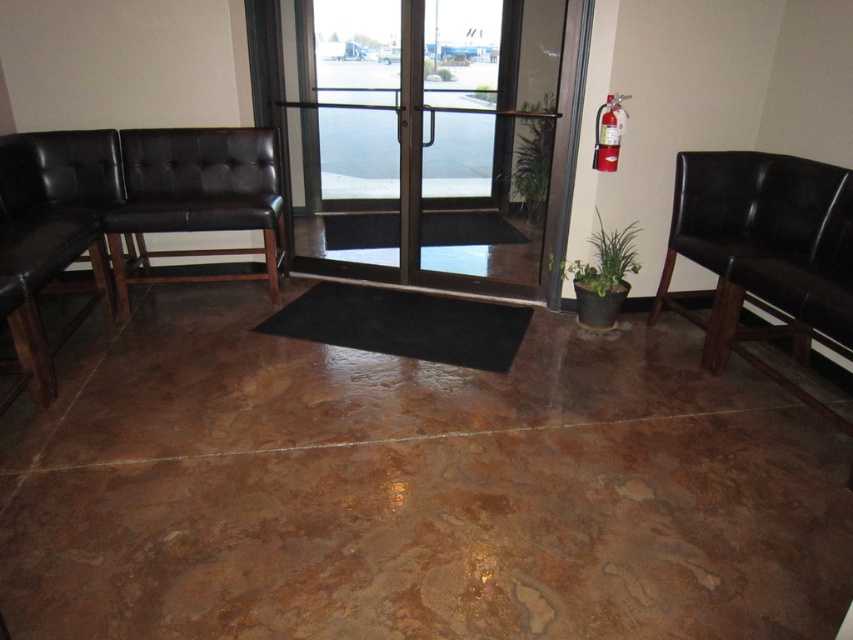
Looking at this image, between black leather chair at right and matte black bench at left, which one appears on the right side from the viewer's perspective?

Positioned to the right is black leather chair at right.

This screenshot has width=853, height=640. Describe the element at coordinates (764, 236) in the screenshot. I see `black leather chair at right` at that location.

Is point (660, 282) less distant than point (228, 193)?

Yes.

Identify the location of black leather chair at right. (764, 236).

This screenshot has height=640, width=853. What do you see at coordinates (764, 236) in the screenshot?
I see `black leather chair at right` at bounding box center [764, 236].

Is black leather chair at right behind black rubber mat at center?

No, it is not.

Where is `black leather chair at right`? The height and width of the screenshot is (640, 853). black leather chair at right is located at coordinates (764, 236).

This screenshot has height=640, width=853. What are the coordinates of `black leather chair at right` in the screenshot? It's located at (764, 236).

Who is taller, matte black bench at left or black rubber mat at center?

matte black bench at left

Is matte black bench at left thinner than black rubber mat at center?

Indeed, matte black bench at left has a lesser width compared to black rubber mat at center.

Is point (111, 244) positioned in front of point (310, 339)?

No.

Locate an element on the screen. The image size is (853, 640). matte black bench at left is located at coordinates (196, 198).